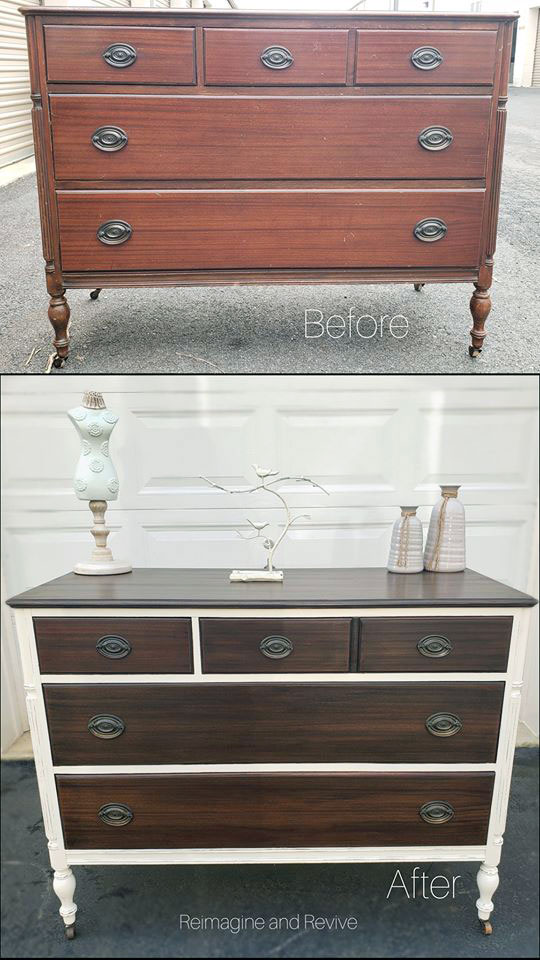
The height and width of the screenshot is (960, 540). Identify the location of floors/rugs. (176, 337), (159, 893).